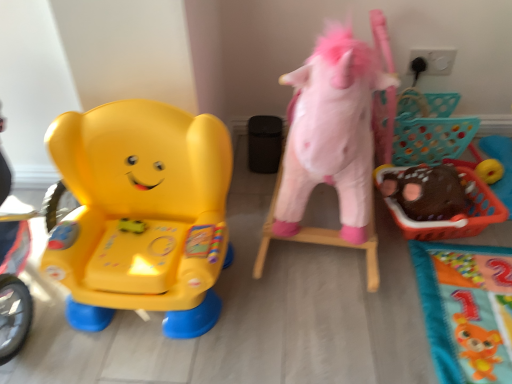
Locate an element on the screen. vacant space to the right of matte plastic elephant at left, the first toy viewed from the left is located at coordinates (303, 295).